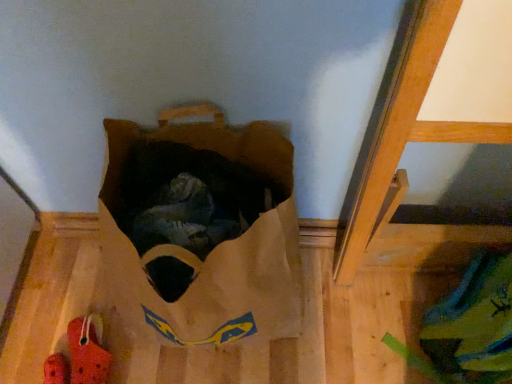
Identify the location of spots to the right of rubber/crocodile at lower left. (159, 358).